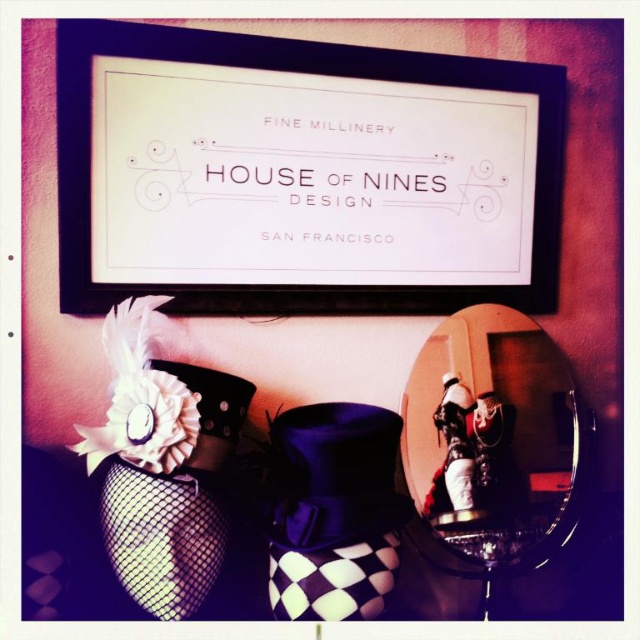
You are an interior designer assessing the wall space in the image. The black matte picture frame at upper center and the white fabric flower at lower left are both displayed on the same wall. Which object would cast a larger shadow if the light source is directly above them?

The black matte picture frame at upper center is larger in size than the white fabric flower at lower left, so it would cast a larger shadow.

You are an interior designer assessing the wall layout. The client wants to know if the white fabric flower at lower left is positioned below the black matte picture frame at upper center. Can you confirm this?

The black matte picture frame at upper center is above the white fabric flower at lower left, so yes, the white fabric flower at lower left is positioned below the black matte picture frame at upper center.